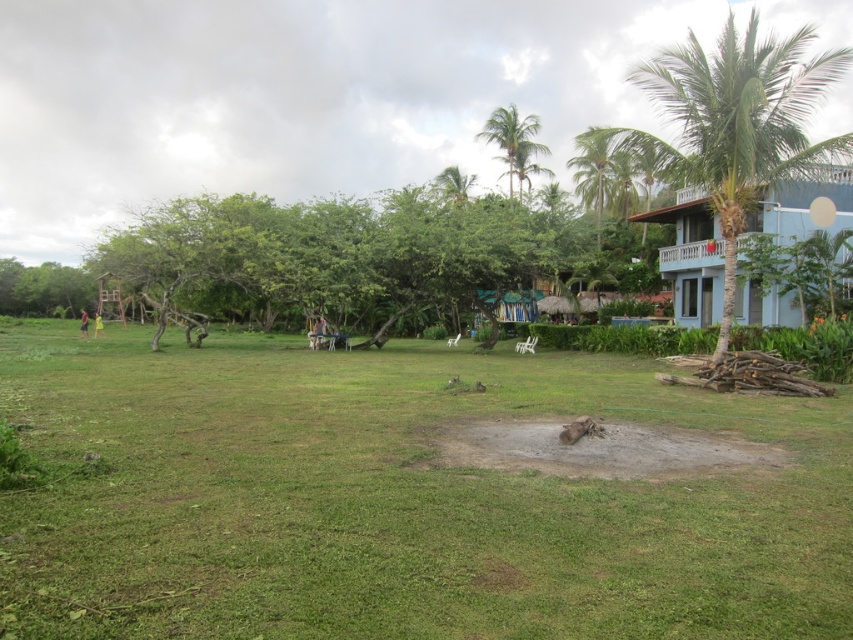
Question: Which is nearer to the green fabric person at lower left?

Choices:
 (A) green grass at lower left
 (B) green grass at center

Answer: (A)

Question: Which of these objects is positioned farthest from the green leafy palm tree at upper center?

Choices:
 (A) green grass at lower left
 (B) green grass at center
 (C) green leafy palm tree at right

Answer: (A)

Question: Can you confirm if green grass at center is thinner than green leafy palm tree at upper center?

Choices:
 (A) no
 (B) yes

Answer: (A)

Question: Which object appears closest to the camera in this image?

Choices:
 (A) green fabric person at lower left
 (B) green leafy palm tree at right
 (C) green grass at lower left

Answer: (B)

Question: Can you confirm if green leafy palm tree at upper center is wider than green grass at lower left?

Choices:
 (A) no
 (B) yes

Answer: (A)

Question: Is green grass at center bigger than green leafy palm tree at upper center?

Choices:
 (A) no
 (B) yes

Answer: (A)